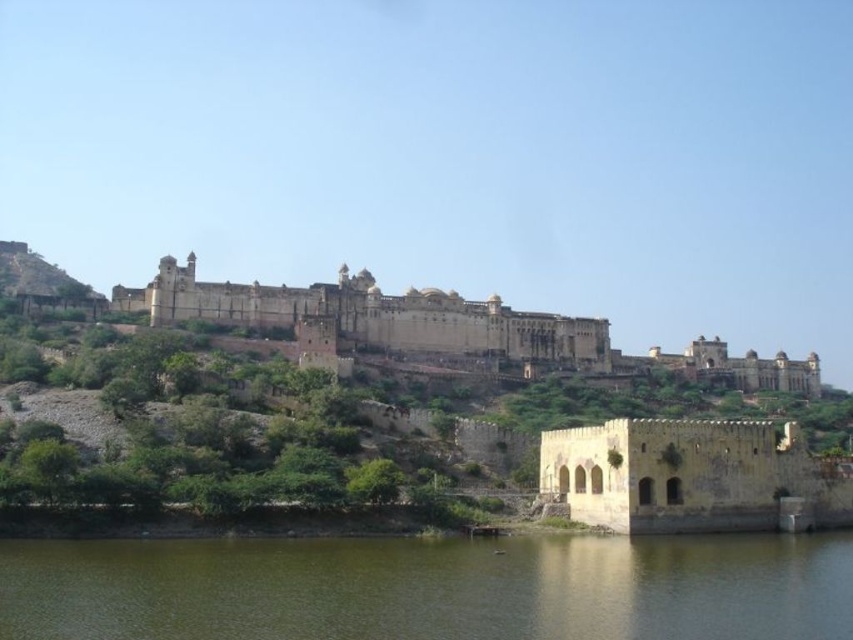
Can you confirm if greenish water at lower center is positioned above yellow stone fort at lower right?

Actually, greenish water at lower center is below yellow stone fort at lower right.

Can you confirm if greenish water at lower center is smaller than yellow stone fort at lower right?

Yes.

Is point (540, 611) farther from camera compared to point (741, 502)?

That is False.

Identify the location of greenish water at lower center. (430, 588).

Does point (589, 541) come closer to viewer compared to point (608, 353)?

Yes, it is in front of point (608, 353).

Does greenish water at lower center appear under brown stone palace at center?

Yes, greenish water at lower center is below brown stone palace at center.

This screenshot has width=853, height=640. What do you see at coordinates (430, 588) in the screenshot?
I see `greenish water at lower center` at bounding box center [430, 588].

This screenshot has width=853, height=640. Find the location of `greenish water at lower center`. greenish water at lower center is located at coordinates (430, 588).

Does yellow stone fort at lower right have a smaller size compared to brown stone palace at center?

Indeed, yellow stone fort at lower right has a smaller size compared to brown stone palace at center.

In the scene shown: Does yellow stone fort at lower right appear under brown stone palace at center?

Indeed, yellow stone fort at lower right is positioned under brown stone palace at center.

Locate an element on the screen. yellow stone fort at lower right is located at coordinates (691, 476).